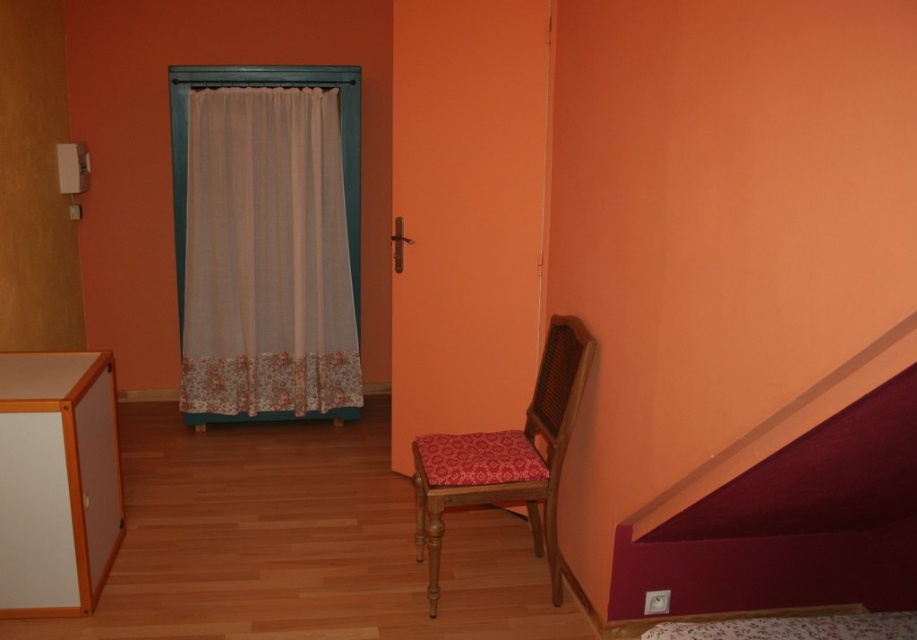
At what (x,y) coordinates should I click in order to perform the action: click on maroon fabric stair at lower right. Please return your answer as a coordinate pair (x, y). Image resolution: width=917 pixels, height=640 pixels. Looking at the image, I should click on (792, 502).

What do you see at coordinates (792, 502) in the screenshot? This screenshot has width=917, height=640. I see `maroon fabric stair at lower right` at bounding box center [792, 502].

Find the location of a particular element. The image size is (917, 640). maroon fabric stair at lower right is located at coordinates (792, 502).

Is sheer fabric curtain at left bigger than floral fabric bed at lower right?

Yes.

Is sheer fabric curtain at left further to the viewer compared to floral fabric bed at lower right?

Yes, it is behind floral fabric bed at lower right.

Who is more distant from viewer, (358, 109) or (889, 634)?

Point (358, 109)

Locate an element on the screen. The width and height of the screenshot is (917, 640). sheer fabric curtain at left is located at coordinates (202, 262).

Can you confirm if orange wood cabinet at lower left is shorter than floral fabric bed at lower right?

No.

Between point (94, 541) and point (719, 625), which one is positioned behind?

The point (94, 541) is more distant.

Between point (70, 570) and point (841, 628), which one is positioned in front?

Point (841, 628) is more forward.

Locate an element on the screen. orange wood cabinet at lower left is located at coordinates (56, 480).